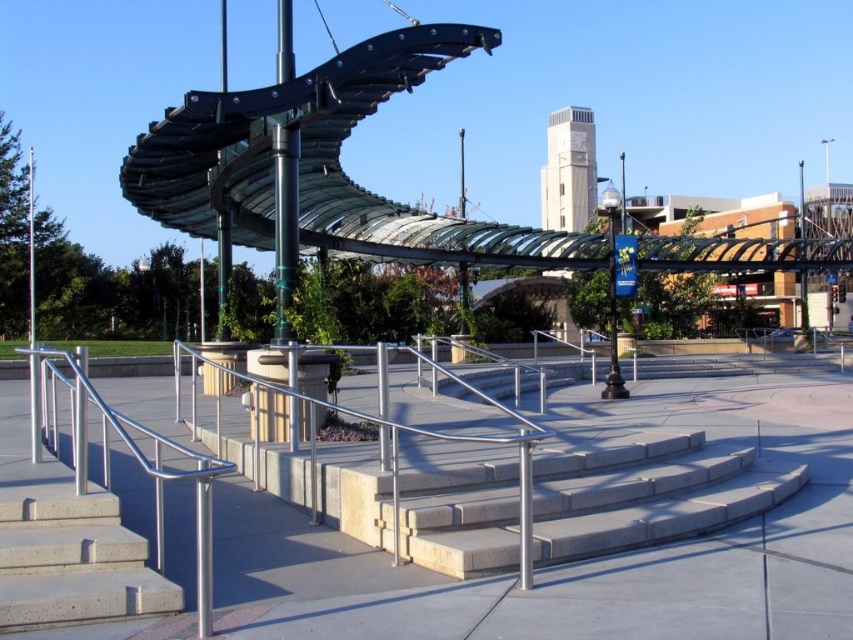
Is light gray concrete stairs at center shorter than concrete/steps at lower left?

No, light gray concrete stairs at center is not shorter than concrete/steps at lower left.

Is point (643, 449) farther from camera compared to point (76, 497)?

Yes, it is behind point (76, 497).

Is point (505, 467) farther from camera compared to point (131, 556)?

That is True.

Where is `light gray concrete stairs at center`? light gray concrete stairs at center is located at coordinates (647, 493).

How distant is concrete/steps at lower left from metallic glass canopy at center?

The distance of concrete/steps at lower left from metallic glass canopy at center is 20.51 meters.

Between point (20, 497) and point (758, 244), which one is positioned in front?

Point (20, 497)

Does point (70, 577) come in front of point (587, 108)?

Yes, point (70, 577) is in front of point (587, 108).

Where is `concrete/steps at lower left`? concrete/steps at lower left is located at coordinates (73, 561).

Between light gray concrete stairs at center and stainless steel handrail at lower left, which one is positioned higher?

stainless steel handrail at lower left is higher up.

Identify the location of light gray concrete stairs at center. (647, 493).

The width and height of the screenshot is (853, 640). In order to click on light gray concrete stairs at center in this screenshot , I will do [647, 493].